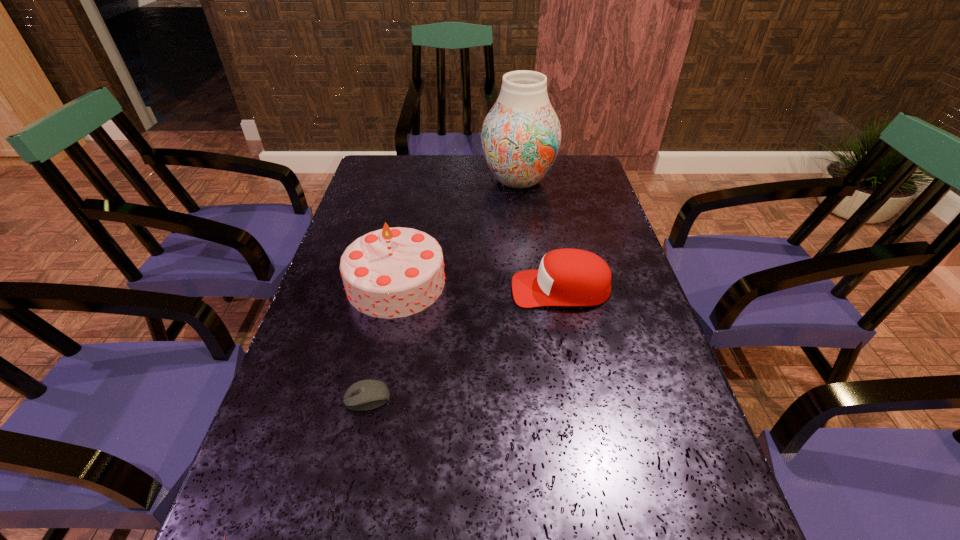
At what (x,y) coordinates should I click in order to perform the action: click on free location located on the front-facing side of the baseball cap. Please return your answer as a coordinate pair (x, y). Looking at the image, I should click on (438, 289).

Find the location of a particular element. The width and height of the screenshot is (960, 540). vacant space positioned on the right of the taller mouse is located at coordinates (463, 398).

Identify the location of object that is at the far edge. This screenshot has width=960, height=540. tap(521, 135).

At what (x,y) coordinates should I click in order to perform the action: click on birthday cake that is at the left edge. Please return your answer as a coordinate pair (x, y). Looking at the image, I should click on (395, 272).

Image resolution: width=960 pixels, height=540 pixels. In order to click on computer equipment at the left edge in this screenshot , I will do `click(368, 394)`.

Locate an element on the screen. The image size is (960, 540). vase that is at the right edge is located at coordinates (521, 135).

The height and width of the screenshot is (540, 960). In order to click on baseball cap at the right edge in this screenshot , I will do point(566,277).

At what (x,y) coordinates should I click in order to perform the action: click on object positioned at the far right corner. Please return your answer as a coordinate pair (x, y). Looking at the image, I should click on (521, 135).

Image resolution: width=960 pixels, height=540 pixels. In order to click on vacant region at the far edge of the desktop in this screenshot , I will do `click(435, 168)`.

In the image, there is a desktop. Identify the location of vacant space at the left edge. (327, 270).